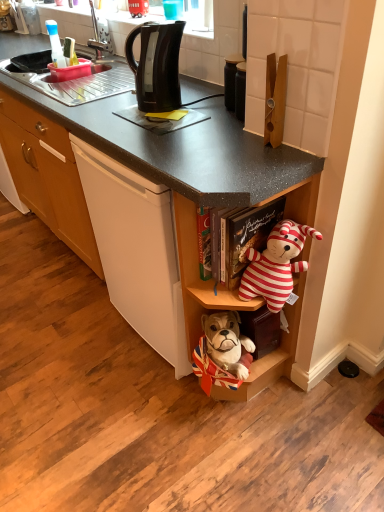
Find the location of a particular element. free space in front of black matte jar at upper center is located at coordinates [x=223, y=122].